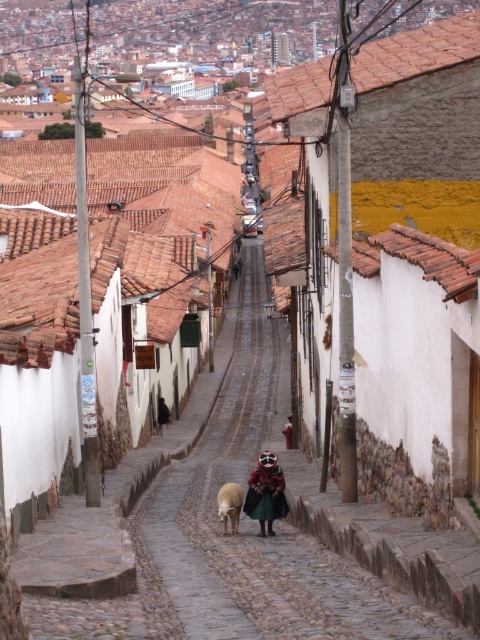
Is point (275, 467) closer to camera compared to point (239, 515)?

Yes, it is.

Is multicolored woven fabric at center behind white woolen sheep at center?

Yes, multicolored woven fabric at center is further from the viewer.

Between point (264, 481) and point (240, 509), which one is positioned behind?

Positioned behind is point (240, 509).

At what (x,y) coordinates should I click in order to perform the action: click on multicolored woven fabric at center. Please return your answer as a coordinate pair (x, y). The height and width of the screenshot is (640, 480). Looking at the image, I should click on (265, 492).